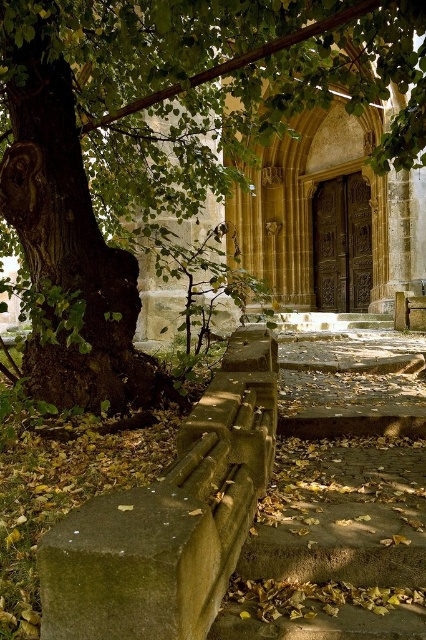
Question: Can you confirm if green leafy tree at upper left is thinner than concrete stairs at center?

Choices:
 (A) yes
 (B) no

Answer: (B)

Question: Is green leafy tree at upper left positioned before concrete stairs at center?

Choices:
 (A) no
 (B) yes

Answer: (A)

Question: Which point is farther from the camera taking this photo?

Choices:
 (A) (282, 586)
 (B) (42, 243)

Answer: (B)

Question: Which point appears farthest from the camera in this image?

Choices:
 (A) (393, 616)
 (B) (108, 337)

Answer: (B)

Question: Is green leafy tree at upper left to the right of concrete stairs at center from the viewer's perspective?

Choices:
 (A) no
 (B) yes

Answer: (A)

Question: Among these points, which one is nearest to the camera?

Choices:
 (A) (397, 579)
 (B) (154, 186)

Answer: (A)